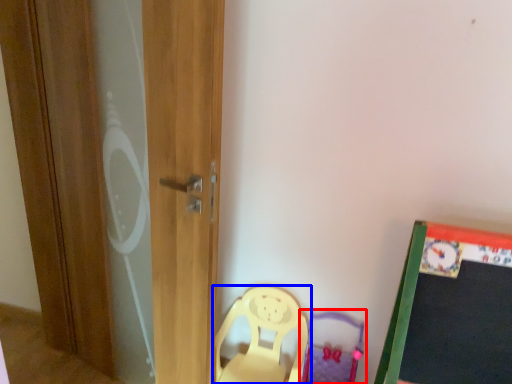
Question: Which point is closer to the camera, swivel chair (highlighted by a red box) or chair (highlighted by a blue box)?

Choices:
 (A) swivel chair
 (B) chair

Answer: (A)